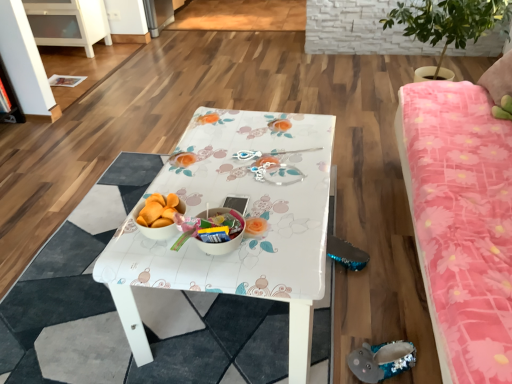
Find the location of `vacant space behind sequined gray slipper at lower right`. vacant space behind sequined gray slipper at lower right is located at coordinates (368, 316).